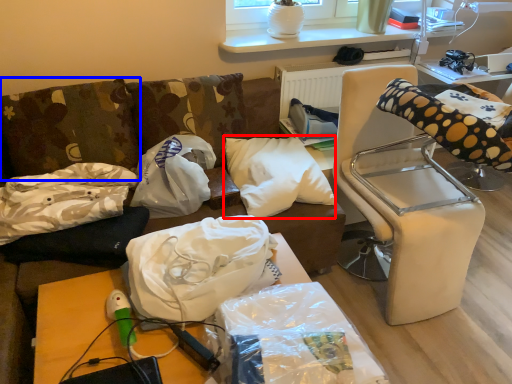
Question: Among these objects, which one is farthest to the camera, pillow (highlighted by a red box) or pillow (highlighted by a blue box)?

Choices:
 (A) pillow
 (B) pillow

Answer: (A)